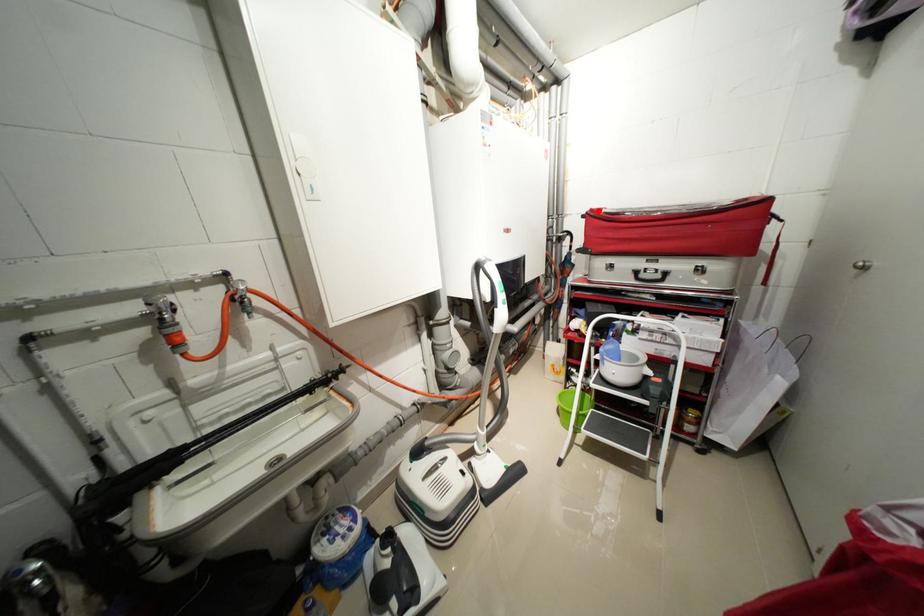
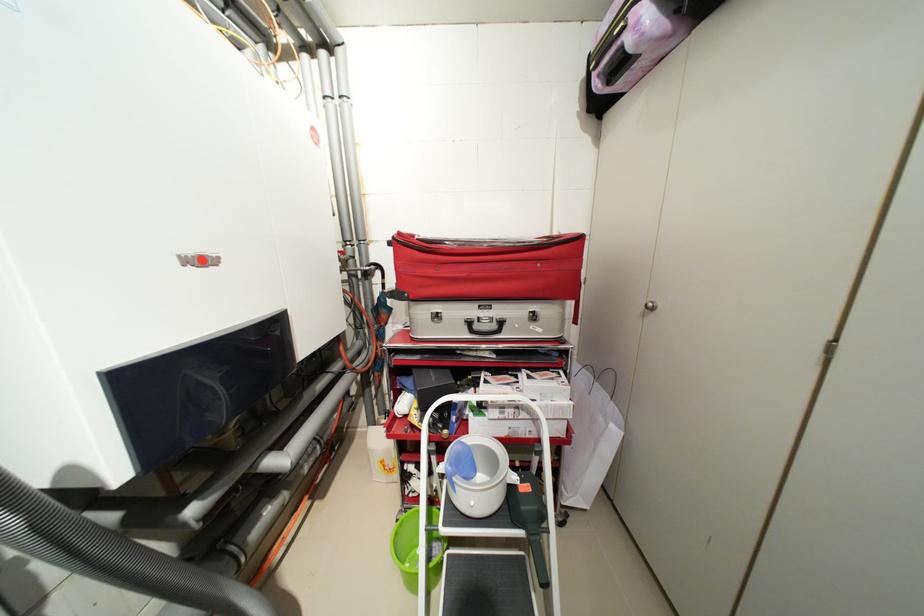
Question: I am providing you with two images of the same scene from different viewpoints. Image1 has a red point marked. In image2, the corresponding 3D location appears at what relative position? Reply with the corresponding letter.

Choices:
 (A) Closer
 (B) Farther

Answer: (B)